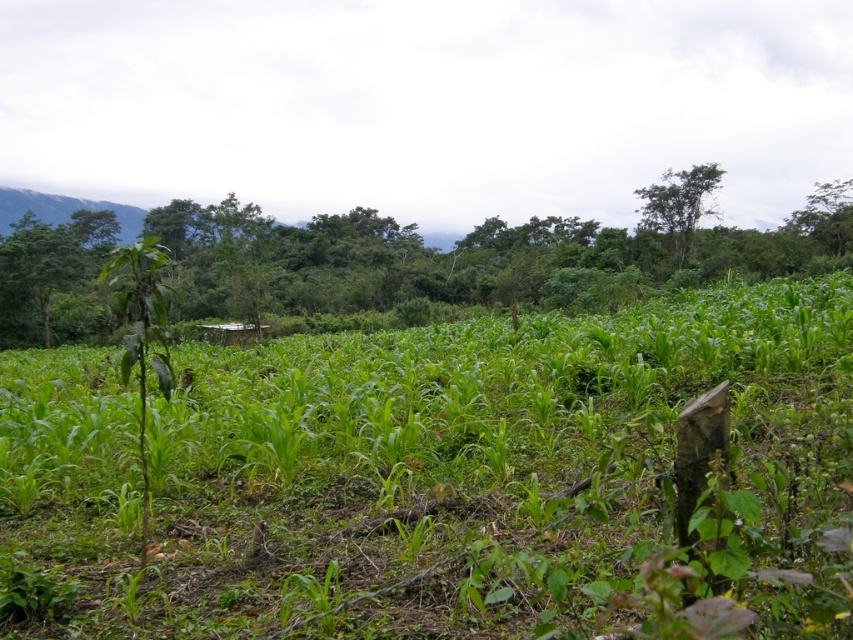
You are a farmer checking the growth of your crops. You notice both the green leafy corn at center and the green leafy tree at center in your field. Which one is shorter?

The green leafy corn at center is smaller than green leafy tree at center, so the green leafy corn at center is shorter.

You are a farmer checking the growth of your crops. You notice the green leafy corn at center and the green leafy tree at upper right. Which one has a wider spread in terms of width?

The green leafy corn at center has a wider spread than the green leafy tree at upper right, as its width is larger according to the description.